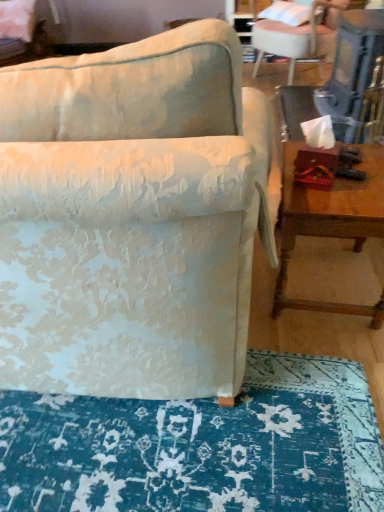
What do you see at coordinates (201, 446) in the screenshot? The image size is (384, 512). I see `blue textured rug at lower center` at bounding box center [201, 446].

How much space does textured fabric chair at center, arranged as the first chair when viewed from the front, occupy vertically?

textured fabric chair at center, arranged as the first chair when viewed from the front, is 38.74 inches tall.

Locate an element on the screen. The image size is (384, 512). white fabric chair at upper right, which is counted as the 1th chair, starting from the back is located at coordinates (299, 36).

Consider the image. Can you tell me how much wooden table at right and white fabric chair at upper right, arranged as the second chair when viewed from the left, differ in facing direction?

The angle between the facing direction of wooden table at right and the facing direction of white fabric chair at upper right, arranged as the second chair when viewed from the left, is 42.7 degrees.

Considering the sizes of objects wooden table at right and white fabric chair at upper right, the first chair when ordered from right to left, in the image provided, who is smaller, wooden table at right or white fabric chair at upper right, the first chair when ordered from right to left,?

With smaller size is wooden table at right.

Considering the sizes of objects wooden table at right and white fabric chair at upper right, the first chair when ordered from right to left, in the image provided, who is thinner, wooden table at right or white fabric chair at upper right, the first chair when ordered from right to left,?

wooden table at right is thinner.

In the scene shown: Is wooden table at right turned away from white fabric chair at upper right, the second chair from the front?

No, white fabric chair at upper right, the second chair from the front, is not at the back of wooden table at right.

Which point is more distant from viewer, (117, 153) or (328, 220)?

The point (328, 220) is farther from the camera.

Does textured fabric chair at center, the 1th chair in the left-to-right sequence, have a smaller size compared to wooden table at right?

No.

Looking at this image, is textured fabric chair at center, the 2th chair in the top-to-bottom sequence, thinner than wooden table at right?

No, textured fabric chair at center, the 2th chair in the top-to-bottom sequence, is not thinner than wooden table at right.

Considering the positions of objects textured fabric chair at center, arranged as the first chair when viewed from the front, and wooden table at right in the image provided, who is more to the left, textured fabric chair at center, arranged as the first chair when viewed from the front, or wooden table at right?

textured fabric chair at center, arranged as the first chair when viewed from the front, is more to the left.

Based on the photo, what's the angular difference between blue textured rug at lower center and wooden table at right's facing directions?

blue textured rug at lower center and wooden table at right are facing 94 degrees away from each other.

Is blue textured rug at lower center directly adjacent to wooden table at right?

They are not placed beside each other.

Which is more to the right, blue textured rug at lower center or wooden table at right?

wooden table at right.

Does blue textured rug at lower center have a smaller size compared to wooden table at right?

Yes, blue textured rug at lower center is smaller than wooden table at right.

Can we say wooden table at right lies outside blue textured rug at lower center?

wooden table at right lies outside blue textured rug at lower center's area.

Is blue textured rug at lower center at the back of wooden table at right?

wooden table at right does not have its back to blue textured rug at lower center.

Considering the positions of objects wooden table at right and blue textured rug at lower center in the image provided, who is more to the right, wooden table at right or blue textured rug at lower center?

wooden table at right is more to the right.

Are wooden table at right and blue textured rug at lower center located far from each other?

No, wooden table at right is not far away from blue textured rug at lower center.

Is white fabric chair at upper right, which is counted as the 1th chair, starting from the back, at the back of blue textured rug at lower center?

No, blue textured rug at lower center is not facing away from white fabric chair at upper right, which is counted as the 1th chair, starting from the back.

How many degrees apart are the facing directions of blue textured rug at lower center and white fabric chair at upper right, arranged as the second chair when viewed from the left?

The angle between the facing direction of blue textured rug at lower center and the facing direction of white fabric chair at upper right, arranged as the second chair when viewed from the left, is 51.3 degrees.

Is blue textured rug at lower center wider or thinner than white fabric chair at upper right, which is counted as the 1th chair, starting from the back?

blue textured rug at lower center is thinner than white fabric chair at upper right, which is counted as the 1th chair, starting from the back.

Does blue textured rug at lower center appear on the right side of white fabric chair at upper right, arranged as the second chair when viewed from the left?

No, blue textured rug at lower center is not to the right of white fabric chair at upper right, arranged as the second chair when viewed from the left.

The width and height of the screenshot is (384, 512). Identify the location of the 2nd chair to the left of the white fabric pillow at upper right, starting your count from the anchor. (132, 217).

Is point (261, 112) positioned in front of point (323, 11)?

Yes, it is.

From a real-world perspective, is textured fabric chair at center, which is the second chair from back to front, positioned above or below white fabric pillow at upper right?

Clearly, from a real-world perspective, textured fabric chair at center, which is the second chair from back to front, is below white fabric pillow at upper right.

Is white fabric chair at upper right, the second chair from the front, looking in the opposite direction of wooden table at right?

white fabric chair at upper right, the second chair from the front, does not have its back to wooden table at right.

Considering the positions of objects white fabric chair at upper right, marked as the second chair in a bottom-to-top arrangement, and wooden table at right in the image provided, who is behind, white fabric chair at upper right, marked as the second chair in a bottom-to-top arrangement, or wooden table at right?

A: white fabric chair at upper right, marked as the second chair in a bottom-to-top arrangement, is behind.

Locate an element on the screen. Image resolution: width=384 pixels, height=512 pixels. chair behind the wooden table at right is located at coordinates (299, 36).

From the image's perspective, is white fabric chair at upper right, the second chair from the front, positioned above or below wooden table at right?

white fabric chair at upper right, the second chair from the front, is situated higher than wooden table at right in the image.

I want to click on table below the white fabric chair at upper right, arranged as the second chair when viewed from the left (from the image's perspective), so (x=331, y=223).

The image size is (384, 512). Find the location of `chair that appears on the left of wooden table at right`. chair that appears on the left of wooden table at right is located at coordinates (132, 217).

From the image, which object appears to be farther from textured fabric chair at center, the 1th chair in the left-to-right sequence, wooden table at right or blue textured rug at lower center?

wooden table at right lies further to textured fabric chair at center, the 1th chair in the left-to-right sequence, than the other object.

Which object lies nearer to the anchor point white fabric chair at upper right, the second chair from the front, textured fabric chair at center, which is the second chair from back to front, or wooden table at right?

wooden table at right is closer to white fabric chair at upper right, the second chair from the front.

Looking at the image, which one is located closer to white fabric chair at upper right, which is counted as the 1th chair, starting from the back, wooden table at right or blue textured rug at lower center?

wooden table at right is closer to white fabric chair at upper right, which is counted as the 1th chair, starting from the back.

Considering their positions, is white fabric chair at upper right, the first chair when ordered from right to left, positioned closer to wooden table at right than white fabric pillow at upper right?

white fabric chair at upper right, the first chair when ordered from right to left, is positioned closer to the anchor wooden table at right.

Estimate the real-world distances between objects in this image. Which object is further from blue textured rug at lower center, white fabric chair at upper right, the second chair from the front, or white fabric pillow at upper right?

white fabric pillow at upper right is further to blue textured rug at lower center.

When comparing their distances from textured fabric chair at center, which ranks as the 2th chair in right-to-left order, does white fabric pillow at upper right or blue textured rug at lower center seem closer?

blue textured rug at lower center lies closer to textured fabric chair at center, which ranks as the 2th chair in right-to-left order, than the other object.

When comparing their distances from blue textured rug at lower center, does textured fabric chair at center, which ranks as the 2th chair in right-to-left order, or white fabric chair at upper right, the first chair when ordered from right to left, seem further?

white fabric chair at upper right, the first chair when ordered from right to left, lies further to blue textured rug at lower center than the other object.

From the image, which object appears to be nearer to textured fabric chair at center, which is the second chair from back to front, blue textured rug at lower center or white fabric chair at upper right, marked as the second chair in a bottom-to-top arrangement?

blue textured rug at lower center lies closer to textured fabric chair at center, which is the second chair from back to front, than the other object.

I want to click on table between textured fabric chair at center, the 1th chair in the left-to-right sequence, and white fabric pillow at upper right from front to back, so click(331, 223).

This screenshot has width=384, height=512. I want to click on table that lies between white fabric pillow at upper right and blue textured rug at lower center from top to bottom, so click(331, 223).

Locate an element on the screen. The height and width of the screenshot is (512, 384). mat situated between textured fabric chair at center, which ranks as the 2th chair in right-to-left order, and wooden table at right from left to right is located at coordinates (201, 446).

Where is `mat between textured fabric chair at center, the 2th chair in the top-to-bottom sequence, and white fabric pillow at upper right in the front-back direction`? This screenshot has height=512, width=384. mat between textured fabric chair at center, the 2th chair in the top-to-bottom sequence, and white fabric pillow at upper right in the front-back direction is located at coordinates (201, 446).